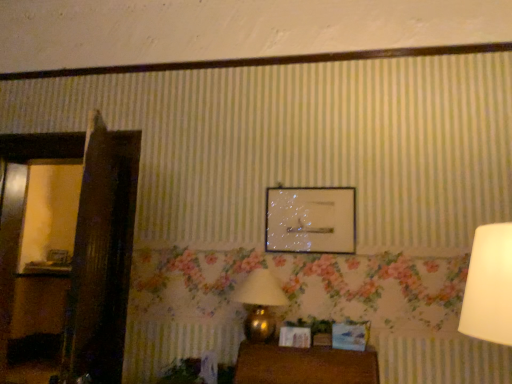
Question: From a real-world perspective, is wooden picture frame at left, marked as the second picture frame in a top-to-bottom arrangement, positioned above or below wooden table at lower center?

Choices:
 (A) above
 (B) below

Answer: (A)

Question: Looking at their shapes, would you say wooden picture frame at left, which is counted as the 1th picture frame, starting from the bottom, is wider or thinner than wooden table at lower center?

Choices:
 (A) thin
 (B) wide

Answer: (A)

Question: Based on their relative distances, which object is farther from the clear glass picture frame at center, placed as the first picture frame when sorted from front to back?

Choices:
 (A) wooden table at lower center
 (B) gold metallic table lamp at lower center
 (C) wooden picture frame at left, marked as the second picture frame in a top-to-bottom arrangement

Answer: (C)

Question: Which is nearer to the clear glass picture frame at center, positioned as the second picture frame in bottom-to-top order?

Choices:
 (A) wooden table at lower center
 (B) gold metallic table lamp at lower center
 (C) wooden picture frame at left, acting as the 1th picture frame starting from the left

Answer: (B)